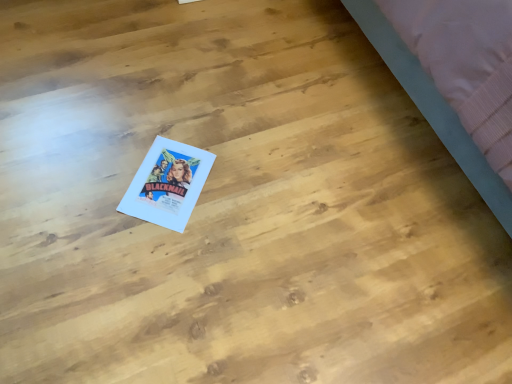
What are the coordinates of `vacant space behind white paper at center` in the screenshot? It's located at (191, 117).